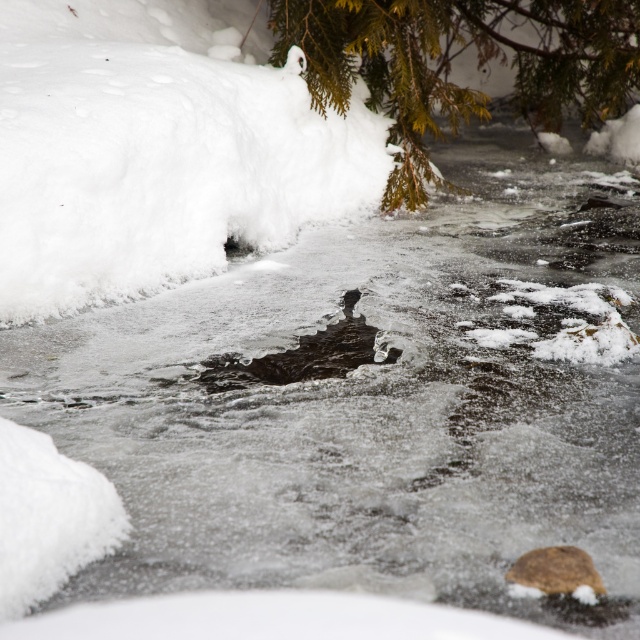
Question: Is white fluffy snow at center wider than green textured branch at upper center?

Choices:
 (A) no
 (B) yes

Answer: (B)

Question: Which object is farther from the camera taking this photo?

Choices:
 (A) green textured branch at upper center
 (B) white fluffy snow at center

Answer: (A)

Question: Which point appears closest to the camera in this image?

Choices:
 (A) (408, 109)
 (B) (180, 148)

Answer: (B)

Question: Which point is farther to the camera?

Choices:
 (A) white fluffy snow at center
 (B) green textured branch at upper center

Answer: (B)

Question: Is white fluffy snow at center in front of green textured branch at upper center?

Choices:
 (A) no
 (B) yes

Answer: (B)

Question: Is white fluffy snow at center bigger than green textured branch at upper center?

Choices:
 (A) no
 (B) yes

Answer: (B)